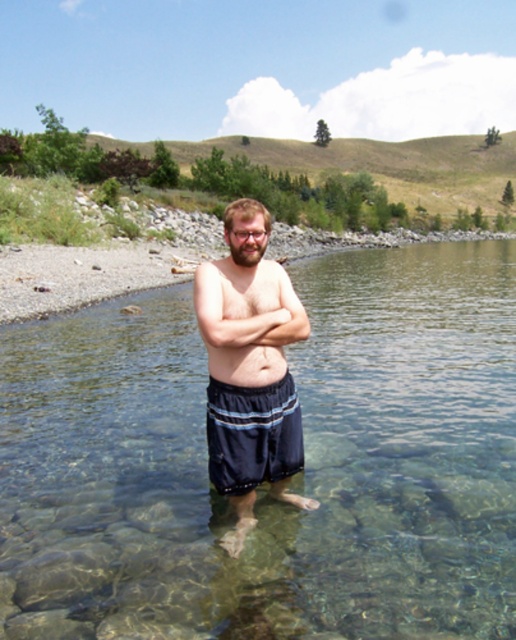
Question: Is clear glass water at center above dark blue shorts at center?

Choices:
 (A) yes
 (B) no

Answer: (A)

Question: Considering the relative positions of dark blue shorts at center and smooth skin belly at center in the image provided, where is dark blue shorts at center located with respect to smooth skin belly at center?

Choices:
 (A) above
 (B) below

Answer: (A)

Question: Which object is positioned closest to the clear glass water at center?

Choices:
 (A) smooth skin belly at center
 (B) dark blue fabric shorts at center

Answer: (B)

Question: Does dark blue shorts at center appear under dark blue fabric shorts at center?

Choices:
 (A) no
 (B) yes

Answer: (A)

Question: Estimate the real-world distances between objects in this image. Which object is closer to the dark blue fabric shorts at center?

Choices:
 (A) smooth skin belly at center
 (B) clear glass water at center
 (C) dark blue shorts at center

Answer: (C)

Question: Among these objects, which one is nearest to the camera?

Choices:
 (A) smooth skin belly at center
 (B) clear glass water at center

Answer: (B)